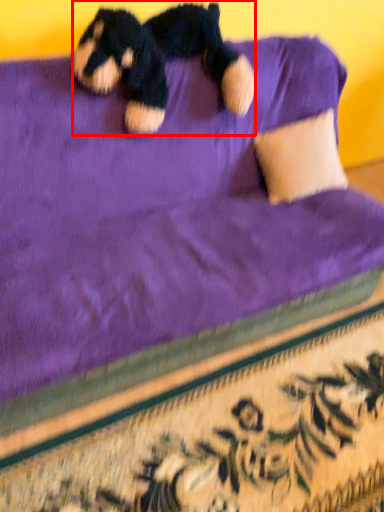
Question: From the image's perspective, what is the correct spatial relationship of teddy bear (annotated by the red box) in relation to pillow?

Choices:
 (A) below
 (B) above

Answer: (B)